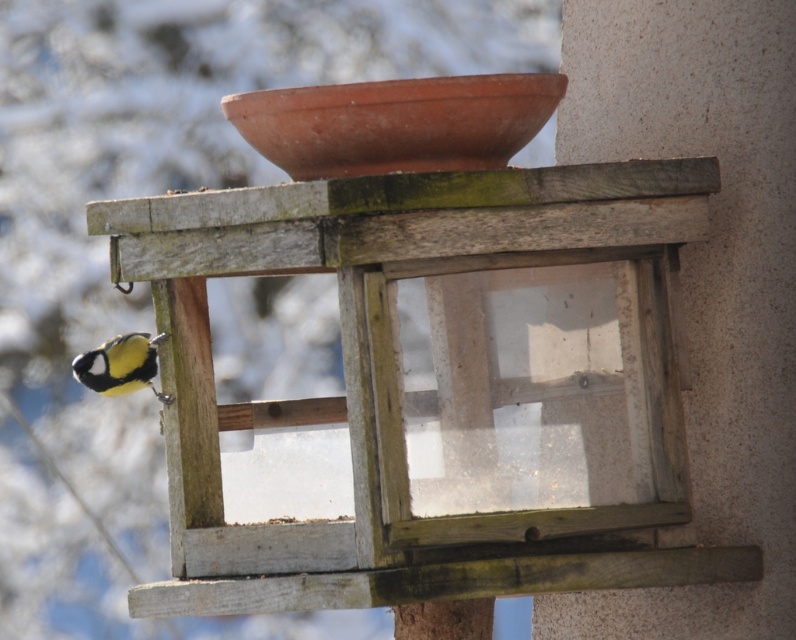
Who is more distant from viewer, [661,257] or [123,372]?

Point [123,372]

Between wooden bird feeder at left and yellow matte bird at lower left, which one is positioned higher?

Positioned higher is yellow matte bird at lower left.

You are a GUI agent. You are given a task and a screenshot of the screen. Output one action in this format:
    pyautogui.click(x=<x>, y=<y>)
    Task: Click on the wooden bird feeder at left
    Image resolution: width=796 pixels, height=640 pixels.
    Given the screenshot: What is the action you would take?
    coord(428,394)